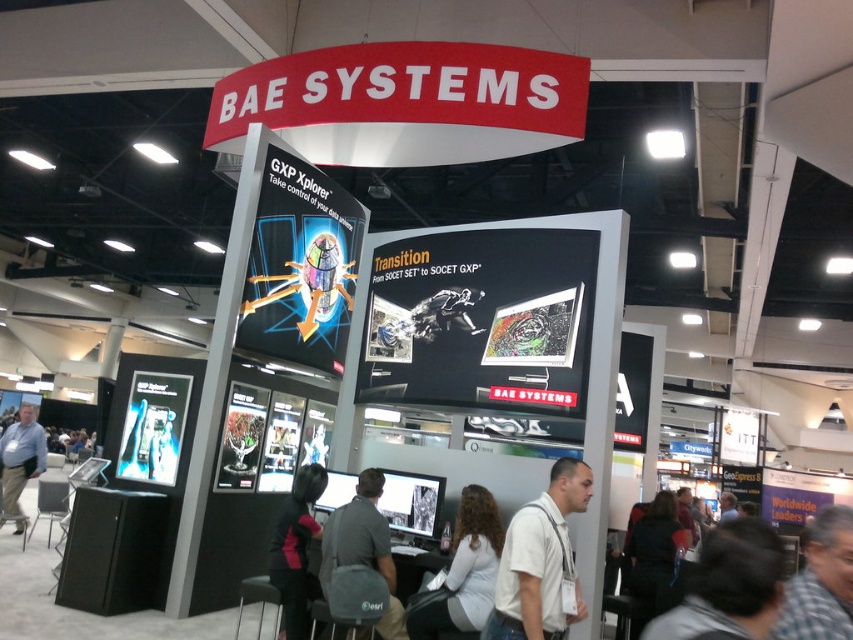
You are a visitor at the BAE Systems exhibition booth. You see a point marked at coordinates (540,561). According to the image, what object is this point located on?

The point at coordinates (540,561) is located on the white cotton shirt at center.

You are a photographer at the BAE Systems exhibition booth and want to capture a clear photo of the light brown leather jacket at center without the white cotton shirt at center blocking it. How should you adjust your camera angle?

The white cotton shirt at center is positioned over light brown leather jacket at center, so you should lower your camera angle to capture the light brown leather jacket at center without obstruction.